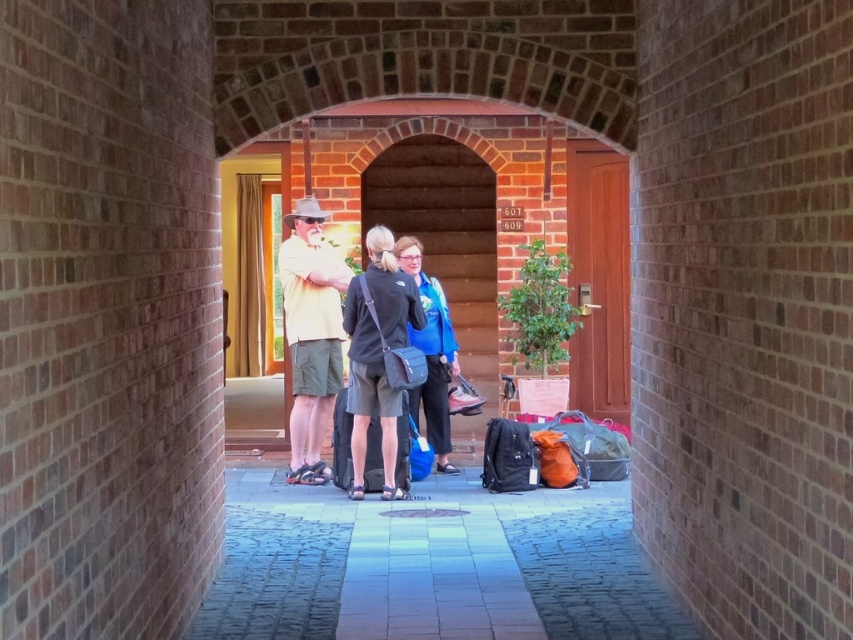
Question: Does black fabric backpack at center have a lesser width compared to blue fabric backpack at center?

Choices:
 (A) no
 (B) yes

Answer: (A)

Question: Which point is farther to the camera?

Choices:
 (A) black fabric backpack at center
 (B) light yellow cotton shirt at center
 (C) blue fabric backpack at center

Answer: (B)

Question: Which of these objects is positioned farthest from the light yellow cotton shirt at center?

Choices:
 (A) blue fabric backpack at center
 (B) black fabric backpack at center

Answer: (A)

Question: Estimate the real-world distances between objects in this image. Which object is closer to the blue fabric backpack at center?

Choices:
 (A) black fabric backpack at center
 (B) light yellow cotton shirt at center

Answer: (A)

Question: Can you confirm if light yellow cotton shirt at center is bigger than blue fabric backpack at center?

Choices:
 (A) yes
 (B) no

Answer: (A)

Question: Where is light yellow cotton shirt at center located in relation to blue fabric backpack at center in the image?

Choices:
 (A) below
 (B) above

Answer: (B)